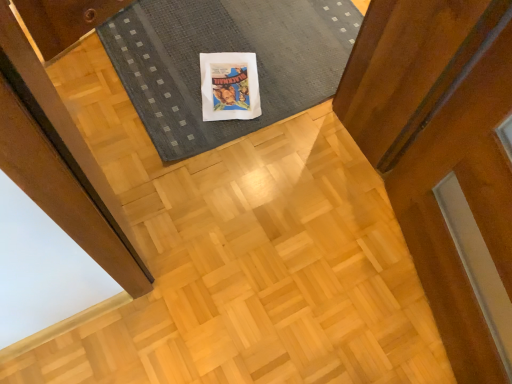
The image size is (512, 384). In order to click on vacant area that is situated to the right of matte white comic book at center in this screenshot , I will do `click(291, 97)`.